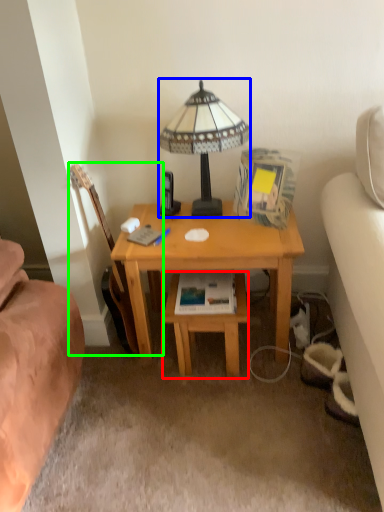
Question: Based on their relative distances, which object is nearer to table (highlighted by a red box)? Choose from lamp (highlighted by a blue box) and guitar (highlighted by a green box).

Choices:
 (A) lamp
 (B) guitar

Answer: (B)